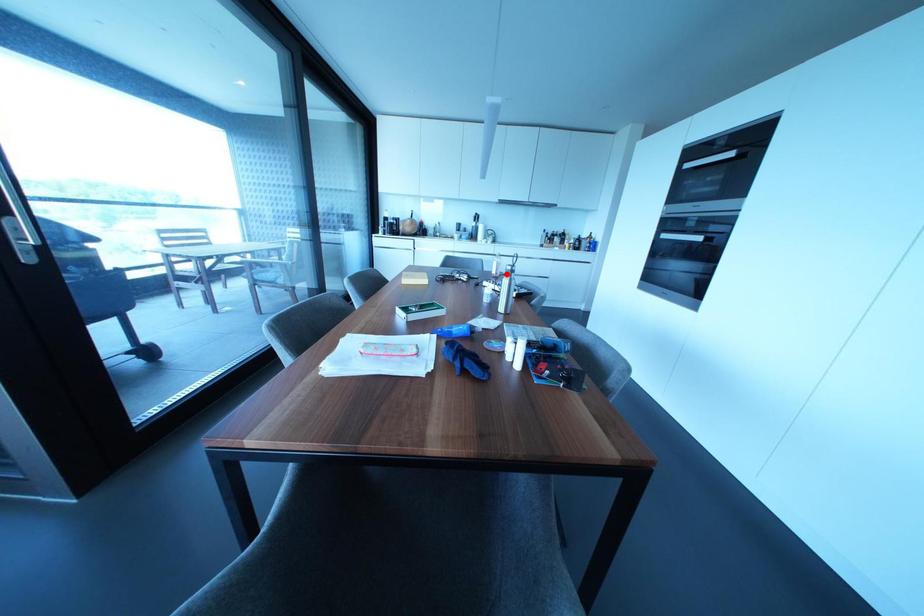
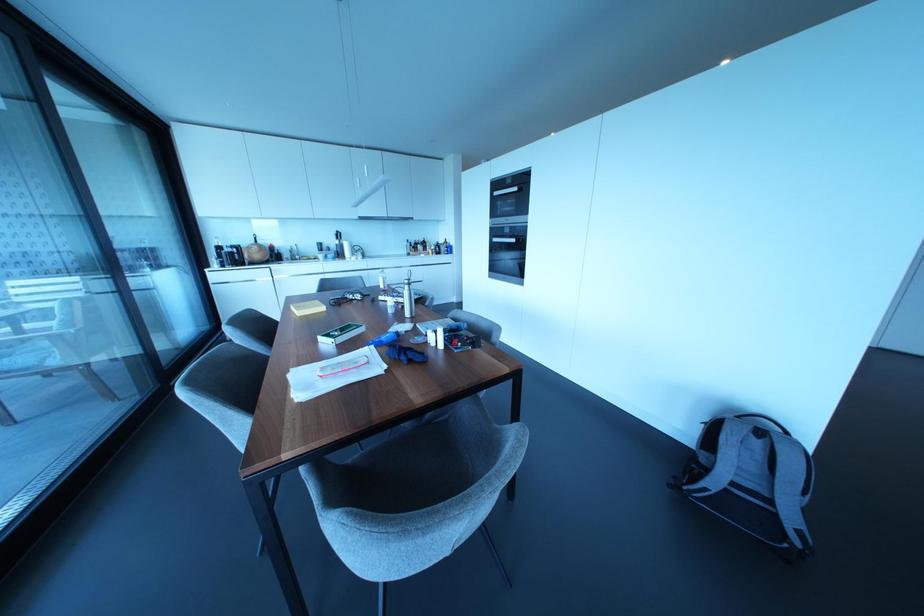
The point at the highlighted location is marked in the first image. Where is the corresponding point in the second image?

(406, 286)